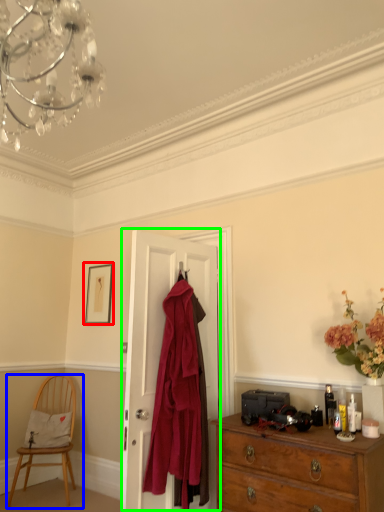
Question: Considering the real-world distances, which object is farthest from picture frame (highlighted by a red box)? chair (highlighted by a blue box) or door (highlighted by a green box)?

Choices:
 (A) chair
 (B) door

Answer: (B)